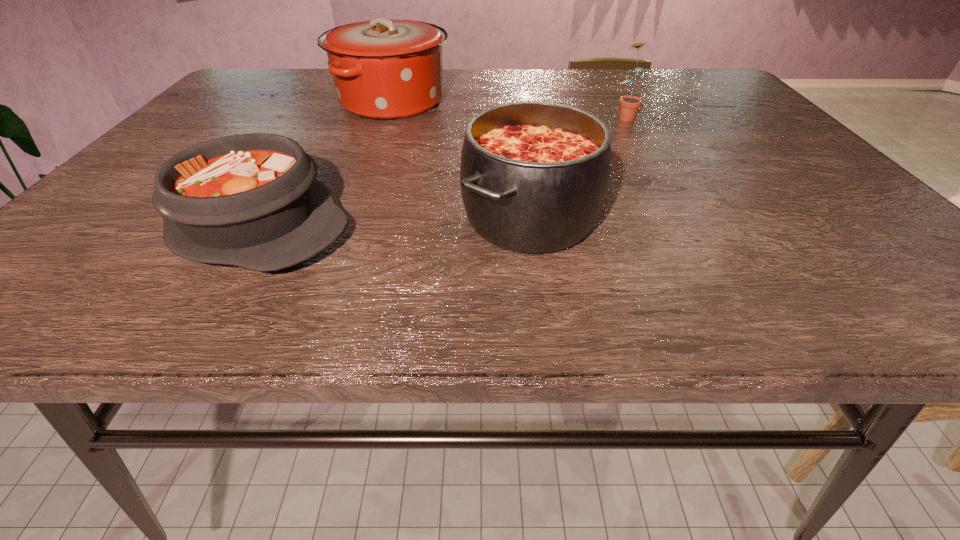
Find the location of a particular element. free space between the tallest casserole and the second shortest casserole is located at coordinates (461, 159).

Where is `object that is the closest to the farthest casserole`? object that is the closest to the farthest casserole is located at coordinates (534, 176).

Identify which object is the second nearest to the rightmost casserole. Please provide its 2D coordinates. Your answer should be formatted as a tuple, i.e. [(x, y)], where the tuple contains the x and y coordinates of a point satisfying the conditions above.

[(383, 69)]

Image resolution: width=960 pixels, height=540 pixels. I want to click on casserole that is the second closest to the shortest object, so click(x=383, y=69).

Where is `casserole that is the closest to the farthest casserole`? The image size is (960, 540). casserole that is the closest to the farthest casserole is located at coordinates (534, 176).